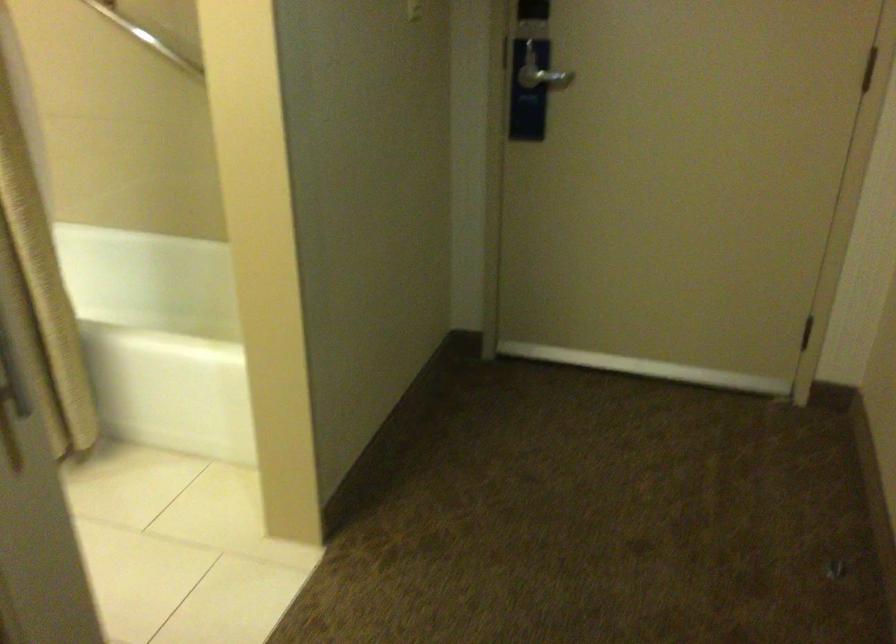
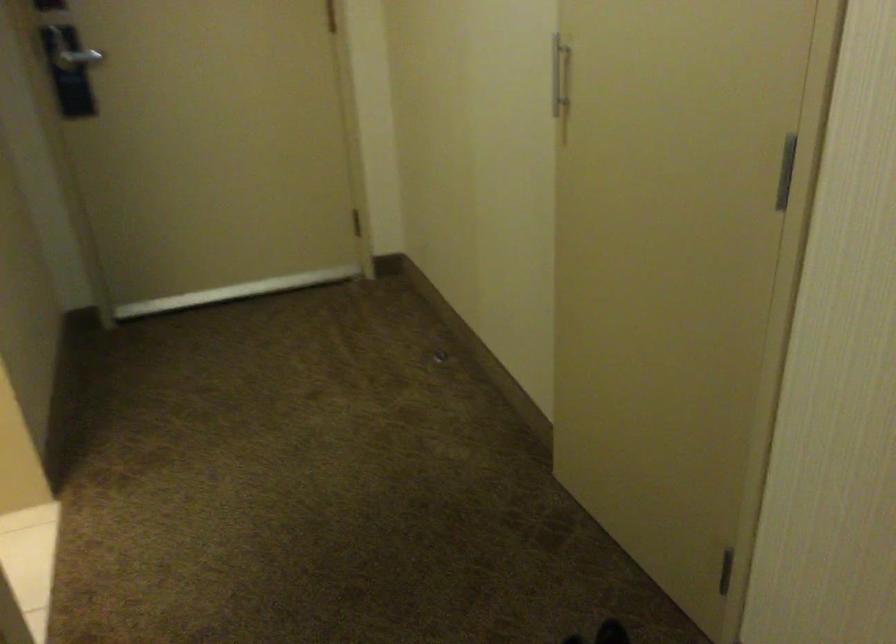
Question: Based on the continuous images, in which direction is the camera rotating? Reply with the corresponding letter.

Choices:
 (A) Left
 (B) Right
 (C) Up
 (D) Down

Answer: (B)